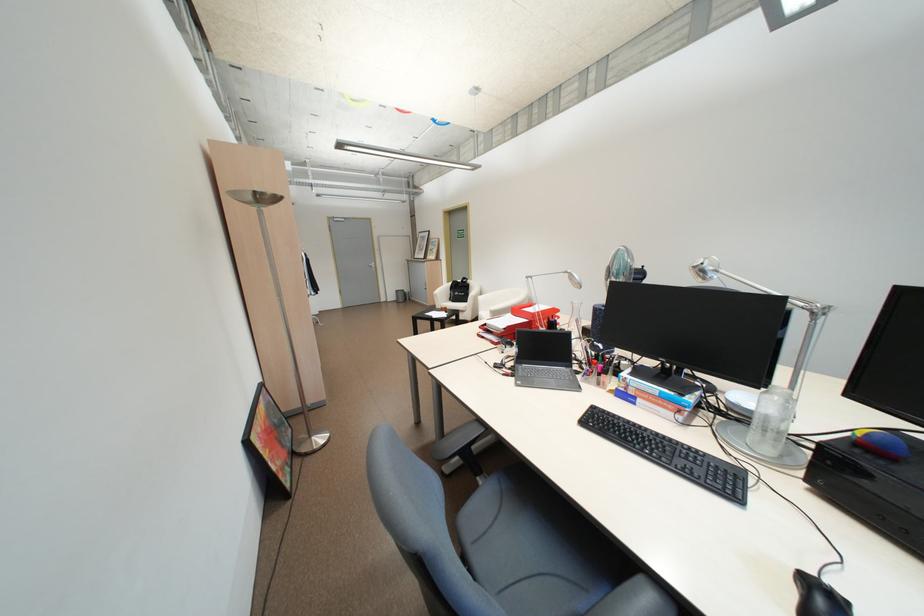
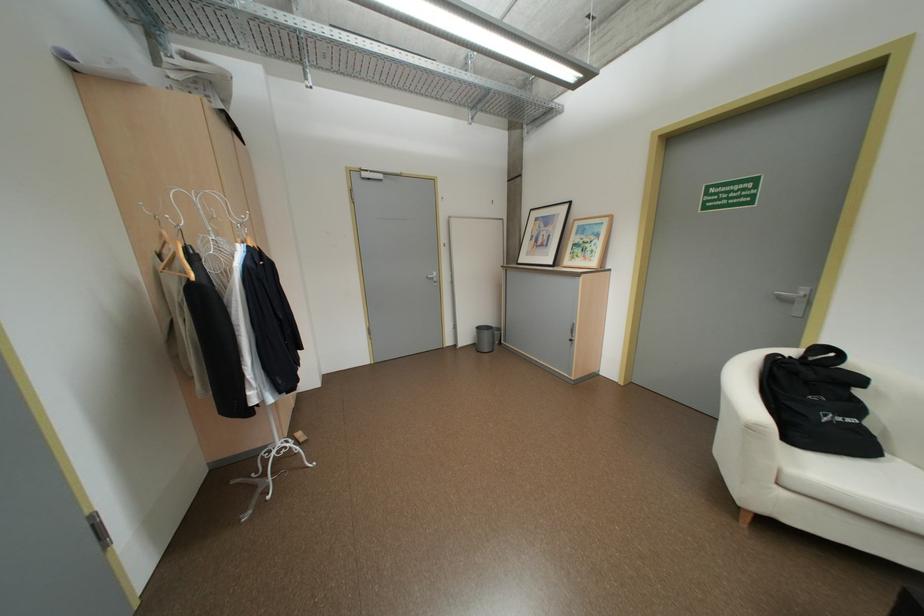
In a continuous first-person perspective shot, in which direction is the camera moving?

The movement direction of the cameraman is left, forward.